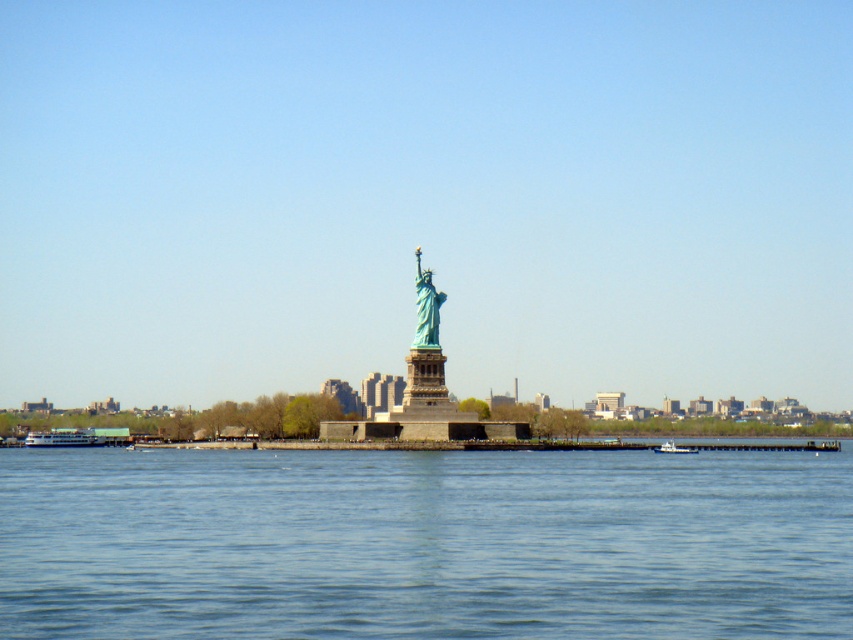
Question: Which object appears farthest from the camera in this image?

Choices:
 (A) metallic gray boat at lower right
 (B) green patina statue at center
 (C) white glossy ferry at lower left
 (D) blue liquid water at center

Answer: (C)

Question: Which object is closer to the camera taking this photo?

Choices:
 (A) white glossy ferry at lower left
 (B) blue liquid water at center
 (C) green patina statue at center
 (D) metallic gray boat at lower right

Answer: (B)

Question: Is white glossy ferry at lower left behind metallic gray boat at lower right?

Choices:
 (A) no
 (B) yes

Answer: (B)

Question: Is green patina statue at center below metallic gray boat at lower right?

Choices:
 (A) no
 (B) yes

Answer: (A)

Question: Based on their relative distances, which object is nearer to the white glossy ferry at lower left?

Choices:
 (A) blue liquid water at center
 (B) metallic gray boat at lower right
 (C) green patina statue at center

Answer: (C)

Question: Does white glossy ferry at lower left appear under metallic gray boat at lower right?

Choices:
 (A) no
 (B) yes

Answer: (A)